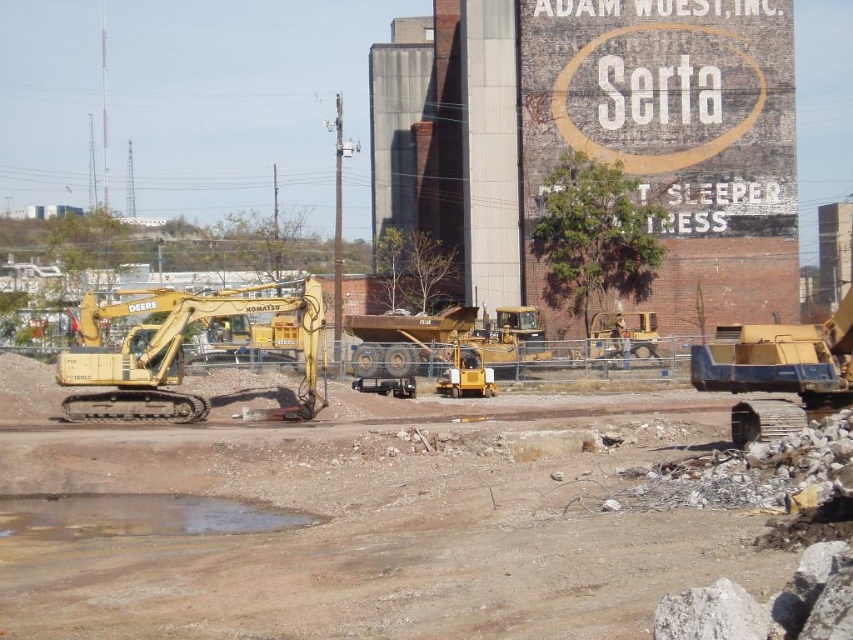
You are a construction worker who needs to move the yellow metallic bulldozer at center to a lower elevation. Given the brown dirt field at center is much taller, what should you do?

Since the brown dirt field at center is much taller than the yellow metallic bulldozer at center, you should lower the bulldozer by moving it to a lower area of the dirt field or another location with lower elevation.

You are a construction worker who needs to transport materials across the brown dirt field at center and the yellow metallic bulldozer at center. Considering their sizes, which area can accommodate a larger vehicle?

The brown dirt field at center has a larger size compared to the yellow metallic bulldozer at center, so the brown dirt field at center can accommodate a larger vehicle.